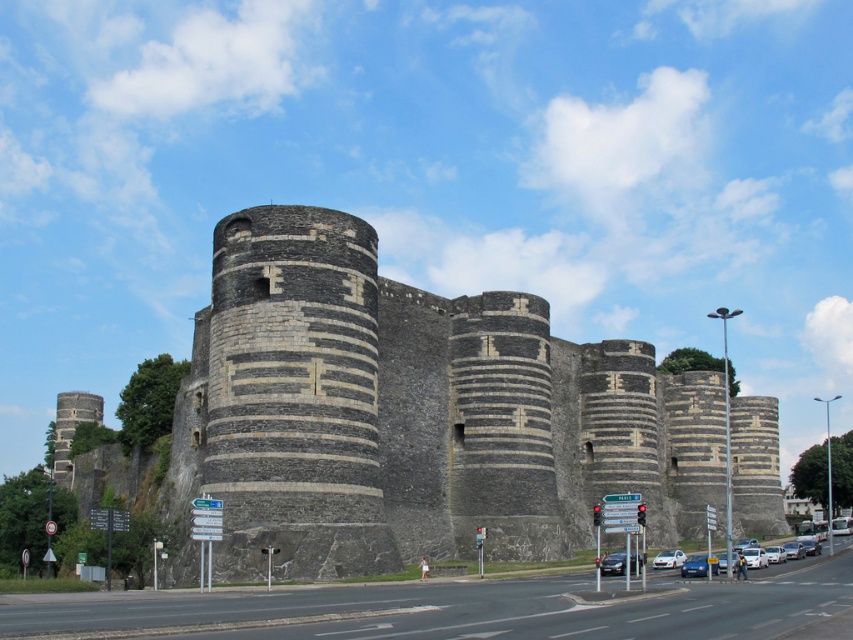
Based on the photo, can you confirm if shiny black sedan at center is positioned below blue metallic car at center?

No, shiny black sedan at center is not below blue metallic car at center.

Does point (602, 561) lie in front of point (715, 560)?

No, (602, 561) is further to viewer.

Is point (601, 563) positioned after point (691, 566)?

That is True.

Where is `shiny black sedan at center`? Image resolution: width=853 pixels, height=640 pixels. shiny black sedan at center is located at coordinates (613, 563).

Is blue metallic car at center bigger than white glossy sedan at center?

Yes.

Is blue metallic car at center above white glossy sedan at center?

Correct, blue metallic car at center is located above white glossy sedan at center.

Locate an element on the screen. The width and height of the screenshot is (853, 640). blue metallic car at center is located at coordinates (698, 564).

Looking at this image, between gray stone castle at center and shiny black sedan at center, which one is positioned higher?

Positioned higher is gray stone castle at center.

Does gray stone castle at center have a larger size compared to shiny black sedan at center?

Yes, gray stone castle at center is bigger than shiny black sedan at center.

Is point (610, 454) more distant than point (621, 554)?

Yes, it is.

Where is `gray stone castle at center`? This screenshot has width=853, height=640. gray stone castle at center is located at coordinates (415, 413).